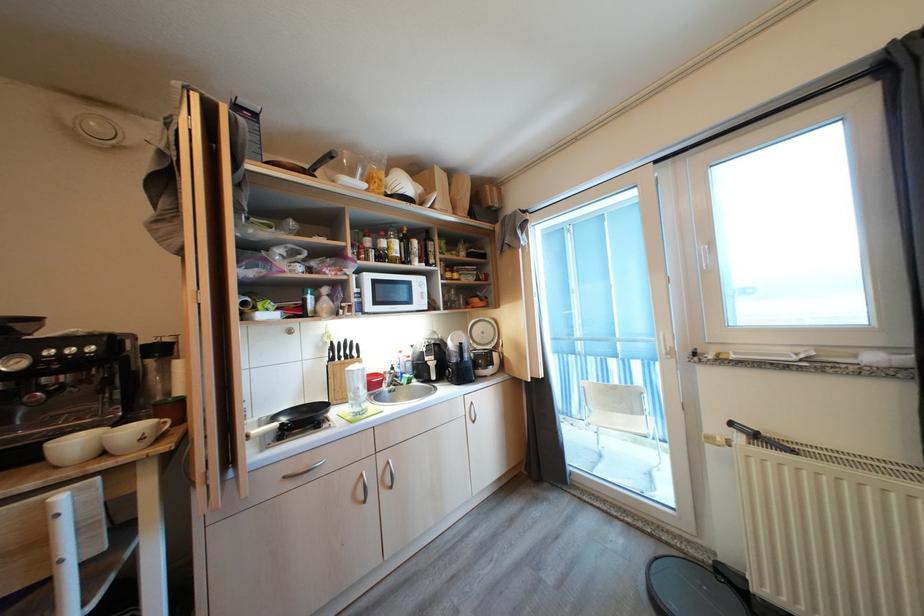
You are a GUI agent. You are given a task and a screenshot of the screen. Output one action in this format:
    pyautogui.click(x=<x>, y=<y>)
    Task: Click on the wooden pan handle
    The height and width of the screenshot is (616, 924).
    Given the screenshot: What is the action you would take?
    pyautogui.click(x=304, y=163)